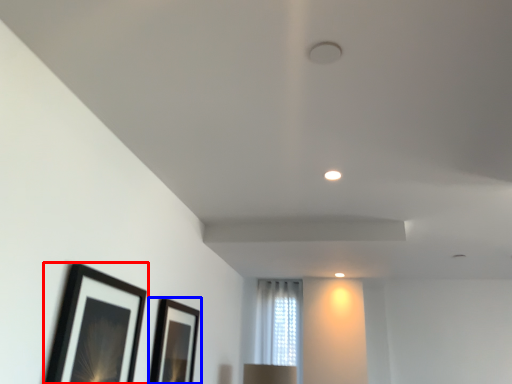
Question: Which of the following is the closest to the observer, picture frame (highlighted by a red box) or picture frame (highlighted by a blue box)?

Choices:
 (A) picture frame
 (B) picture frame

Answer: (A)